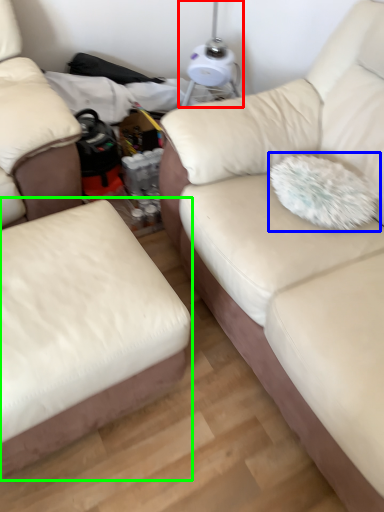
Question: Which is nearer to the table lamp (highlighted by a red box)? throw pillow (highlighted by a blue box) or studio couch (highlighted by a green box).

Choices:
 (A) throw pillow
 (B) studio couch

Answer: (A)